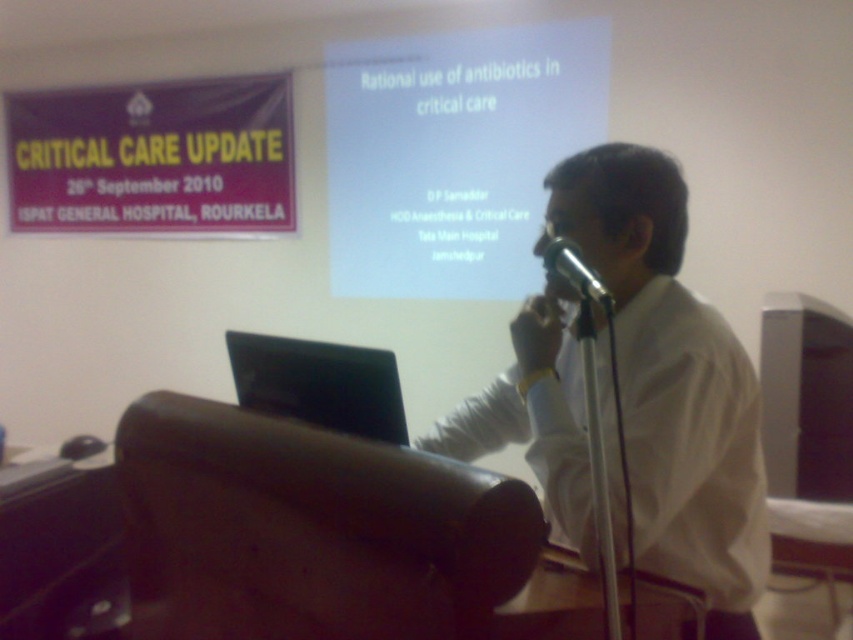
Question: Can you confirm if purple fabric banner at upper left is thinner than metallic silver microphone at center?

Choices:
 (A) no
 (B) yes

Answer: (A)

Question: Is white shirt at center above purple fabric banner at upper left?

Choices:
 (A) yes
 (B) no

Answer: (B)

Question: Which is nearer to the black matte laptop at center?

Choices:
 (A) white shirt at center
 (B) white matte projector screen at upper center
 (C) purple fabric banner at upper left
 (D) metallic silver microphone at center

Answer: (D)

Question: Is white matte projector screen at upper center above black matte laptop at center?

Choices:
 (A) yes
 (B) no

Answer: (A)

Question: Which point appears farthest from the camera in this image?

Choices:
 (A) (251, 339)
 (B) (424, 214)

Answer: (B)

Question: Which object appears farthest from the camera in this image?

Choices:
 (A) purple fabric banner at upper left
 (B) white matte projector screen at upper center
 (C) white shirt at center
 (D) metallic silver microphone at center

Answer: (A)